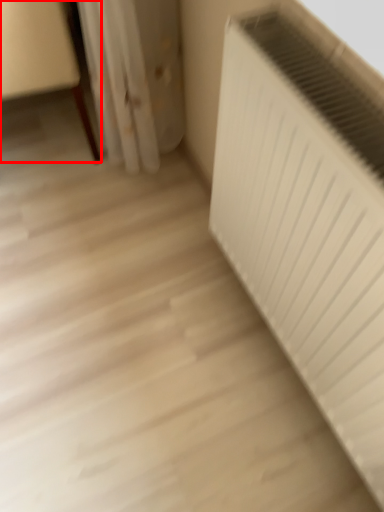
Question: Observing the image, what is the correct spatial positioning of furniture (annotated by the red box) in reference to radiator?

Choices:
 (A) left
 (B) right

Answer: (A)